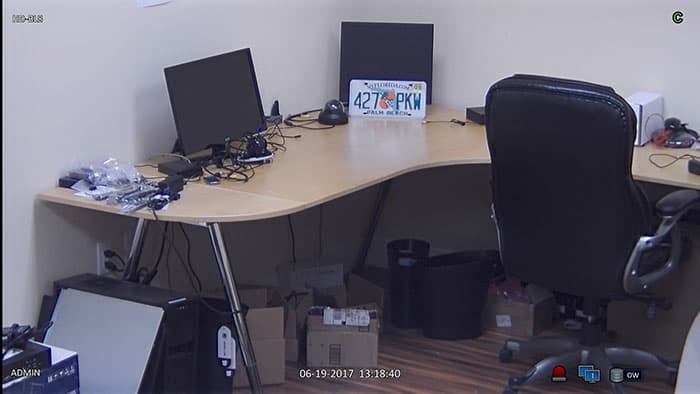
Identify the location of trash can. (447, 308).